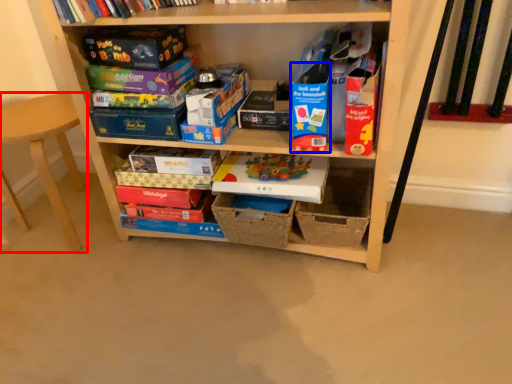
Question: Which point is closer to the camera, armchair (highlighted by a red box) or paperback book (highlighted by a blue box)?

Choices:
 (A) armchair
 (B) paperback book

Answer: (B)